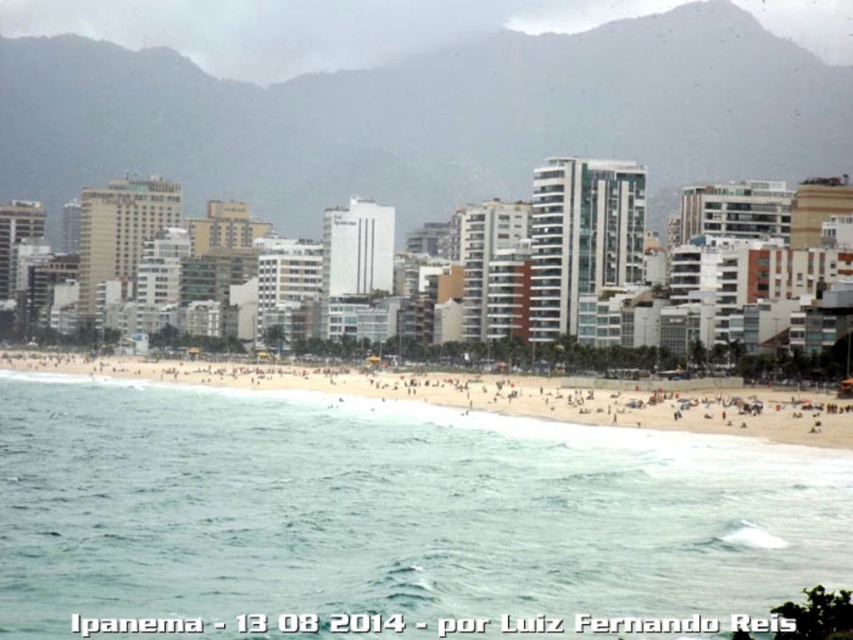
Does clear blue water at lower center have a larger size compared to golden sand beach at center?

Incorrect, clear blue water at lower center is not larger than golden sand beach at center.

Who is more forward, (556, 548) or (41, 360)?

Point (556, 548)

Measure the distance between clear blue water at lower center and camera.

clear blue water at lower center is 68.35 meters away from camera.

Locate an element on the screen. clear blue water at lower center is located at coordinates (387, 509).